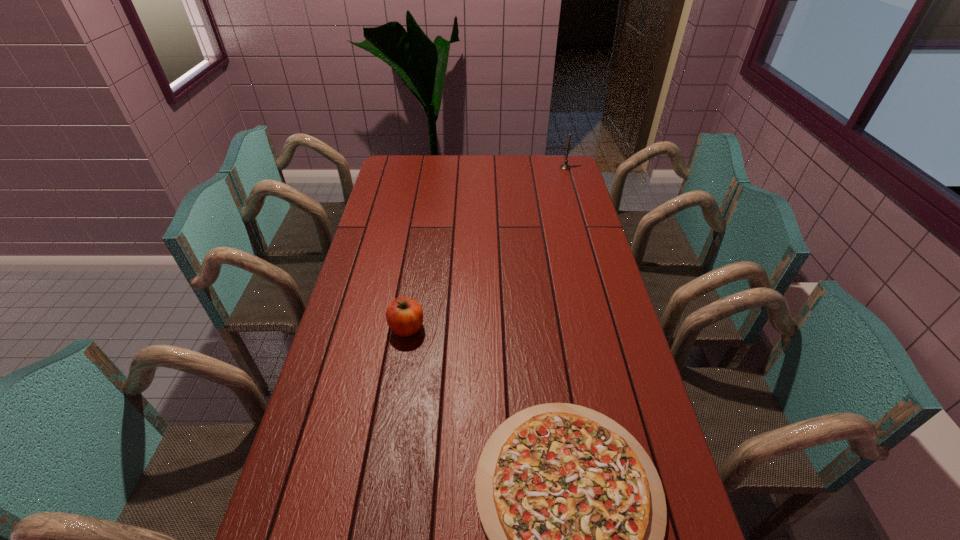
What are the coordinates of `the tallest object` in the screenshot? It's located at (565, 166).

Find the location of `the farthest object`. the farthest object is located at coordinates (565, 166).

At what (x,y) coordinates should I click in order to perform the action: click on the second farthest object. Please return your answer as a coordinate pair (x, y). This screenshot has height=540, width=960. Looking at the image, I should click on (404, 316).

At what (x,y) coordinates should I click in order to perform the action: click on apple. Please return your answer as a coordinate pair (x, y). This screenshot has width=960, height=540. Looking at the image, I should click on (404, 316).

Where is `free space located 0.400m on the left of the tallest object`? Image resolution: width=960 pixels, height=540 pixels. free space located 0.400m on the left of the tallest object is located at coordinates (473, 167).

At what (x,y) coordinates should I click in order to perform the action: click on free space located on the left of the second nearest object. Please return your answer as a coordinate pair (x, y). The height and width of the screenshot is (540, 960). Looking at the image, I should click on 339,328.

Identify the location of object that is at the far edge. This screenshot has width=960, height=540. (565, 166).

This screenshot has height=540, width=960. I want to click on object at the left edge, so click(404, 316).

Find the location of a particular element. object present at the right edge is located at coordinates (565, 166).

The image size is (960, 540). Identify the location of object positioned at the far right corner. (565, 166).